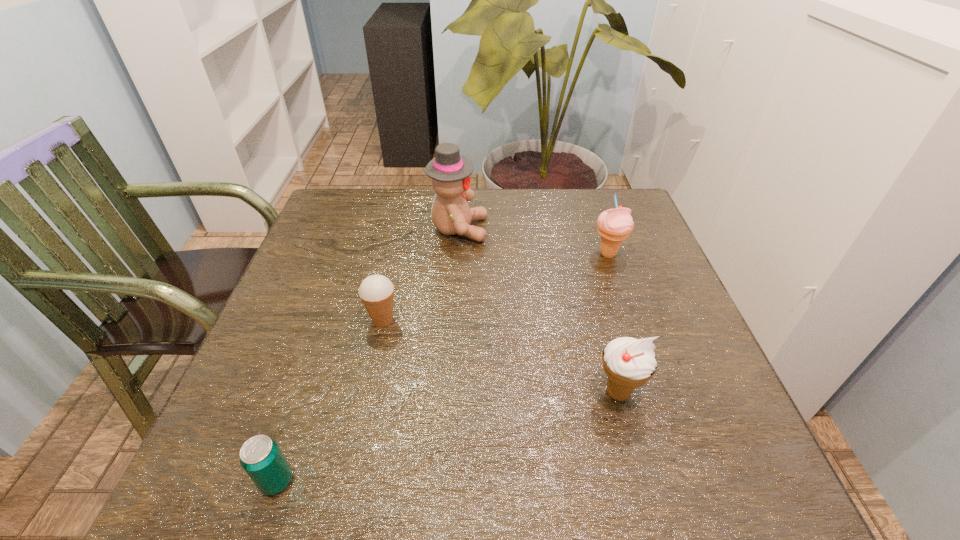
In order to click on free space that satisfies the following two spatial constraints: 1. on the front-facing side of the tallest object; 2. on the front side of the shortest icecream in this screenshot , I will do `click(453, 320)`.

This screenshot has height=540, width=960. In order to click on free spot that satisfies the following two spatial constraints: 1. on the front-facing side of the nearest icecream; 2. on the right side of the third object from right to left in this screenshot , I will do `click(448, 392)`.